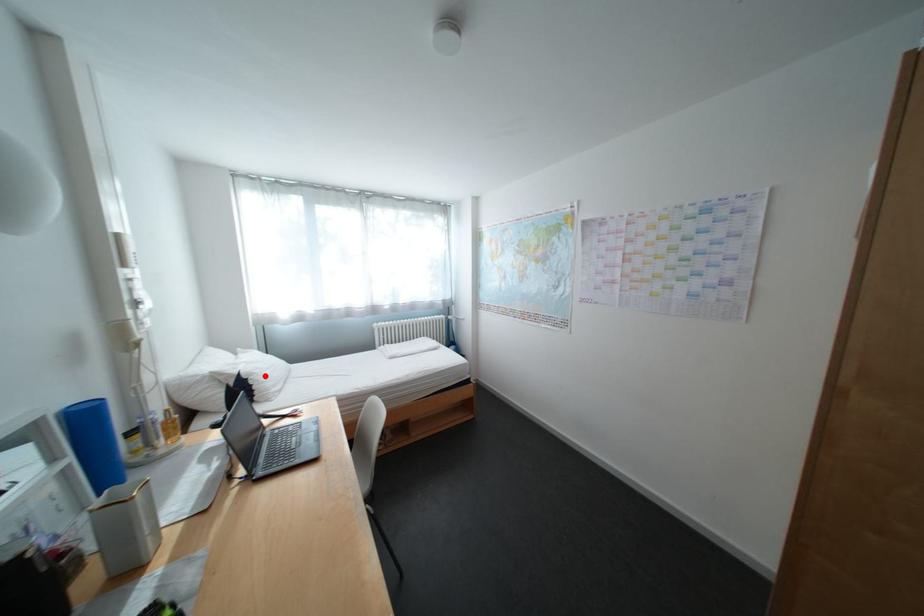
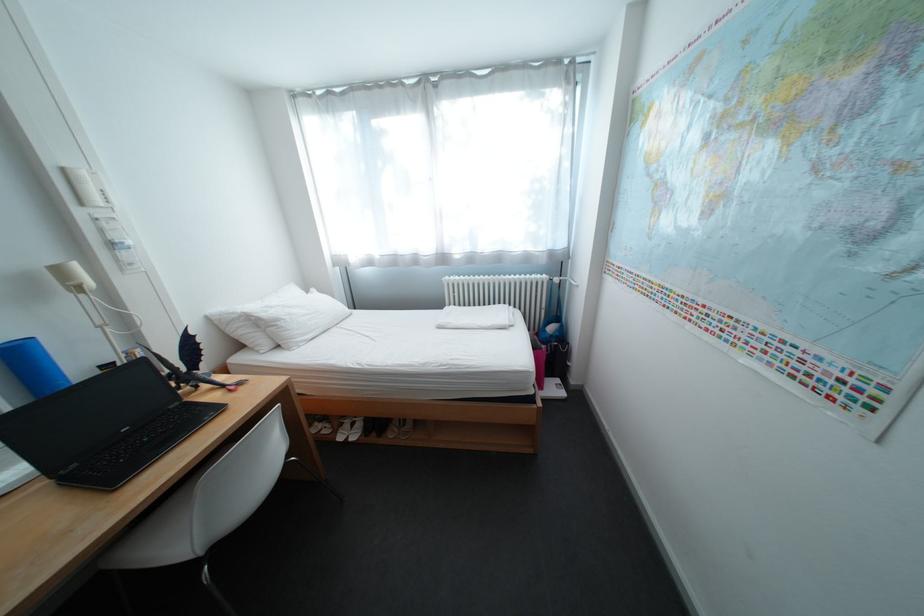
In the second image, find the point that corresponds to the highlighted location in the first image.

(292, 322)